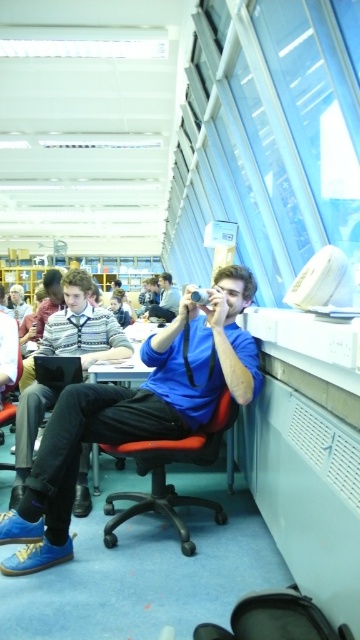
You are trying to decide whether to place a new book on the matte black shirt at center or the matte plastic table at center. Which surface is larger and can accommodate the book more comfortably?

The matte black shirt at center is bigger than the matte plastic table at center, so the matte black shirt at center can accommodate the book more comfortably.

You are a photographer standing at the entrance of the library. You want to take a photo of the matte black shirt at center. Where should you position yourself to ensure the shirt is in the center of your camera frame?

To center the matte black shirt at center in your camera frame, position yourself directly in line with its coordinates at point (83,326).